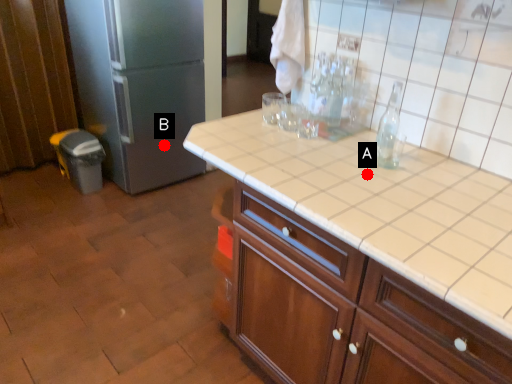
Question: Two points are circled on the image, labeled by A and B beside each circle. Which of the following is the farthest from the observer?

Choices:
 (A) A is further
 (B) B is further

Answer: (B)